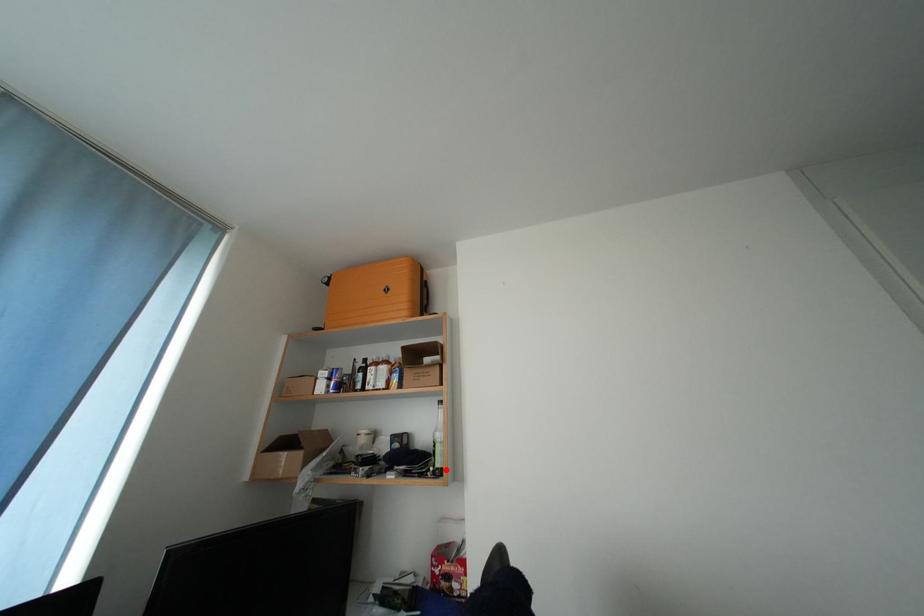
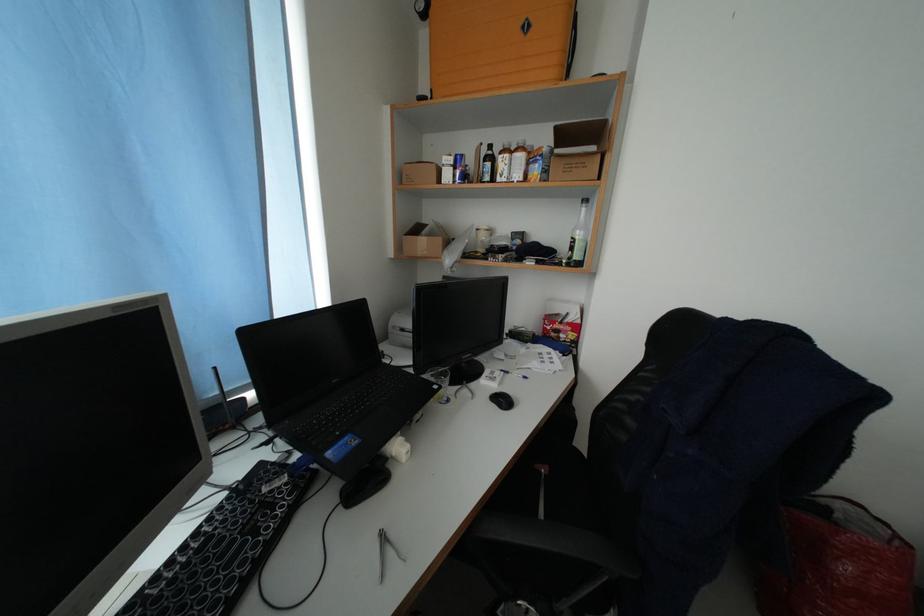
Question: I am providing you with two images of the same scene from different viewpoints. Image1 has a red point marked. In image2, the corresponding 3D location appears at what relative position? Reply with the corresponding letter.

Choices:
 (A) Closer
 (B) Farther

Answer: (A)